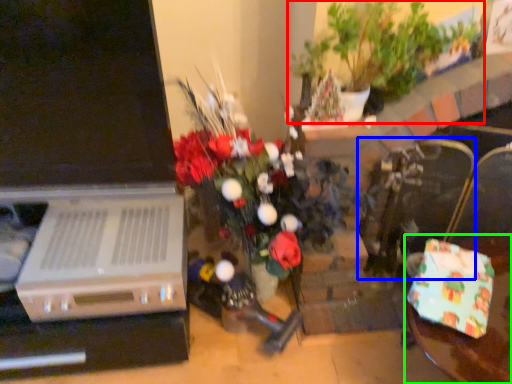
Question: Which is farther away from houseplant (highlighted by a red box)? armchair (highlighted by a blue box) or table (highlighted by a green box)?

Choices:
 (A) armchair
 (B) table

Answer: (B)